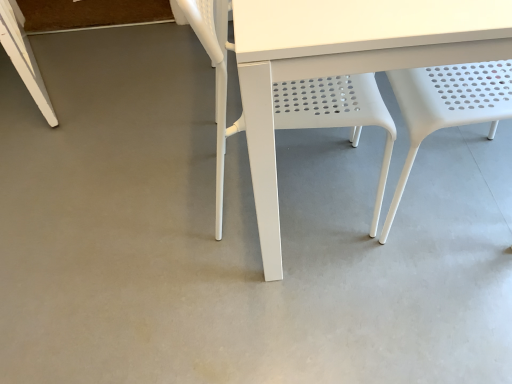
Question: Considering the positions of point (346, 89) and point (394, 89), is point (346, 89) closer or farther from the camera than point (394, 89)?

Choices:
 (A) closer
 (B) farther

Answer: (A)

Question: From their relative heights in the image, would you say white plastic chair at center, which appears as the 2th chair when viewed from the right, is taller or shorter than white perforated plastic chair at center, the second chair from the left?

Choices:
 (A) tall
 (B) short

Answer: (A)

Question: Visually, is white plastic chair at center, placed as the first chair when sorted from left to right, positioned to the left or to the right of white perforated plastic chair at center, which is the first chair in right-to-left order?

Choices:
 (A) right
 (B) left

Answer: (B)

Question: From the image's perspective, relative to white plastic chair at center, placed as the first chair when sorted from left to right, is white perforated plastic chair at center, the second chair from the left, above or below?

Choices:
 (A) above
 (B) below

Answer: (A)

Question: Is white perforated plastic chair at center, the second chair from the left, bigger or smaller than white plastic chair at center, placed as the first chair when sorted from left to right?

Choices:
 (A) small
 (B) big

Answer: (A)

Question: Is white perforated plastic chair at center, the second chair from the left, inside or outside of white plastic chair at center, placed as the first chair when sorted from left to right?

Choices:
 (A) outside
 (B) inside

Answer: (A)

Question: Considering the positions of white perforated plastic chair at center, which is the first chair in right-to-left order, and white plastic chair at center, which appears as the 2th chair when viewed from the right, in the image, is white perforated plastic chair at center, which is the first chair in right-to-left order, taller or shorter than white plastic chair at center, which appears as the 2th chair when viewed from the right,?

Choices:
 (A) short
 (B) tall

Answer: (A)